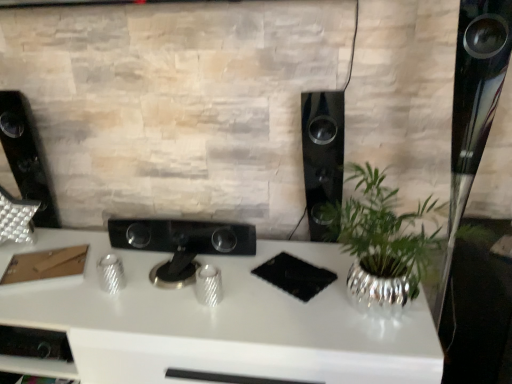
Find the location of a particular element. vacant space underneath black glossy controller at center (from a real-world perspective) is located at coordinates (175, 257).